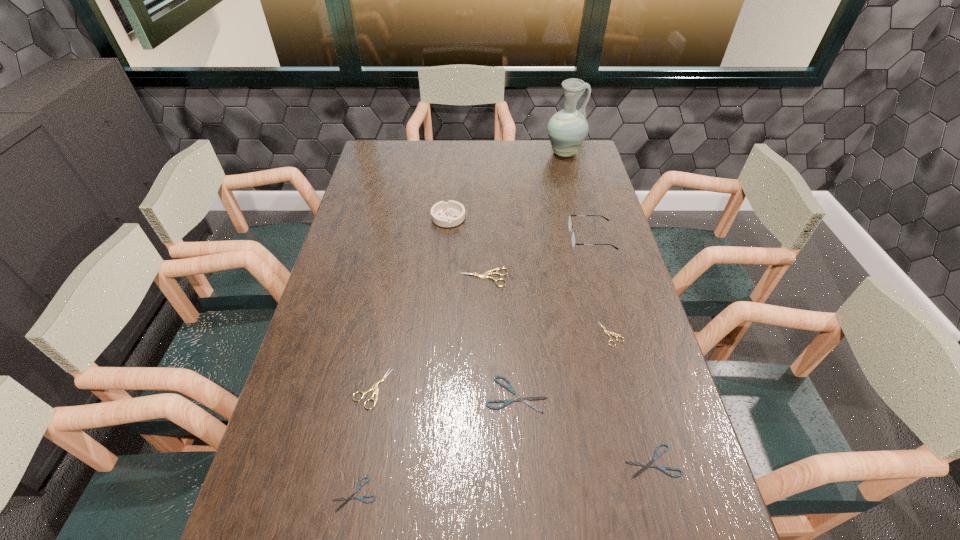
This screenshot has width=960, height=540. Find the location of `the second black shears from right to left`. the second black shears from right to left is located at coordinates (519, 398).

This screenshot has height=540, width=960. I want to click on the rightmost beige shears, so click(x=608, y=333).

This screenshot has height=540, width=960. Find the location of `the second nearest beige shears`. the second nearest beige shears is located at coordinates (608, 333).

Locate an element on the screen. Image resolution: width=960 pixels, height=540 pixels. the rightmost black shears is located at coordinates (650, 464).

Find the location of a particular element. the leftmost black shears is located at coordinates (358, 488).

This screenshot has width=960, height=540. I want to click on the shortest shears, so click(358, 488).

Identify the location of free spot located 0.060m on the lenses of the eighth shortest object. The image size is (960, 540). coord(552,238).

Find the location of `free space located 0.320m on the lenses of the eighth shortest object`. free space located 0.320m on the lenses of the eighth shortest object is located at coordinates (474, 238).

The height and width of the screenshot is (540, 960). I want to click on vacant region located 0.330m on the lenses of the eighth shortest object, so click(x=471, y=238).

Identify the location of free space located on the left of the seventh shortest object. The image size is (960, 540). (377, 218).